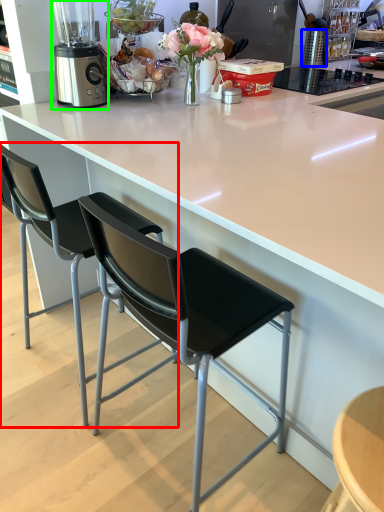
Question: Based on their relative distances, which object is nearer to chair (highlighted by a red box)? Choose from kitchen appliance (highlighted by a blue box) and blender (highlighted by a green box).

Choices:
 (A) kitchen appliance
 (B) blender

Answer: (B)